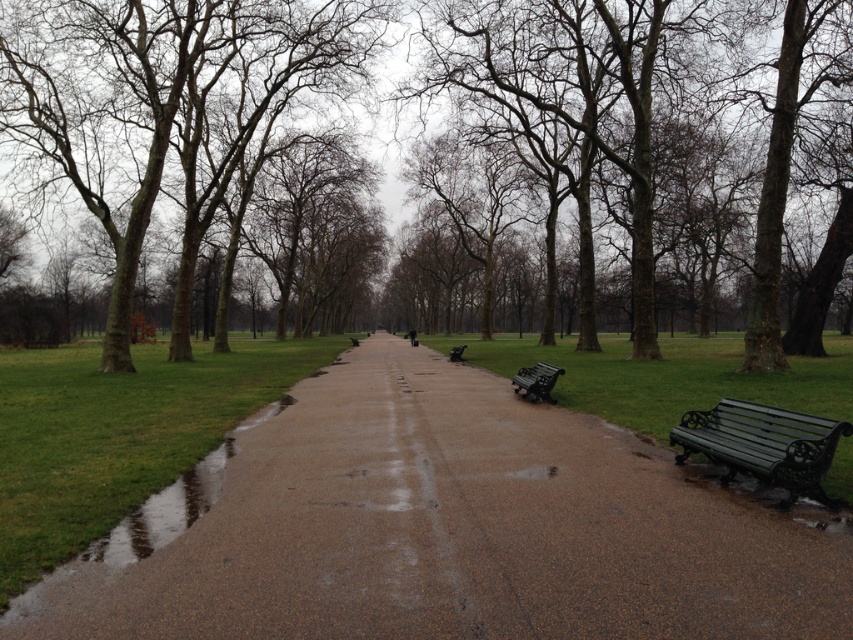
Question: Does smooth asphalt path at center appear under green wrought iron bench at lower right?

Choices:
 (A) no
 (B) yes

Answer: (B)

Question: Which of these objects is positioned closest to the brown smooth tree at center?

Choices:
 (A) green metal bench at lower right
 (B) green metal bench at center

Answer: (B)

Question: Where is brown textured tree at center located in relation to green metal bench at center in the image?

Choices:
 (A) below
 (B) above

Answer: (B)

Question: Is smooth asphalt path at center thinner than green wrought iron bench at lower right?

Choices:
 (A) yes
 (B) no

Answer: (B)

Question: Among these objects, which one is farthest from the camera?

Choices:
 (A) smooth asphalt path at center
 (B) brown textured tree at center
 (C) green wrought iron bench at lower right

Answer: (B)

Question: Which of these objects is positioned farthest from the green metal bench at lower right?

Choices:
 (A) green metal bench at center
 (B) brown textured tree at center
 (C) green wrought iron bench at lower right

Answer: (B)